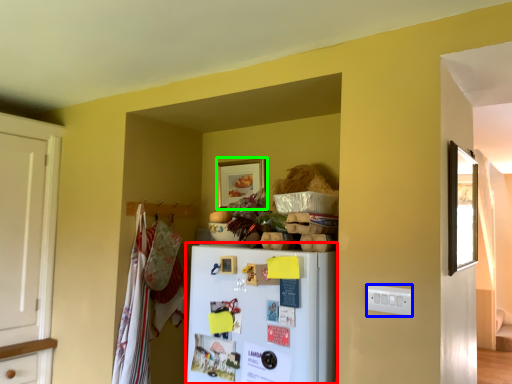
Question: Which is farther away from refrigerator (highlighted by a red box)? electric outlet (highlighted by a blue box) or picture frame (highlighted by a green box)?

Choices:
 (A) electric outlet
 (B) picture frame

Answer: (B)